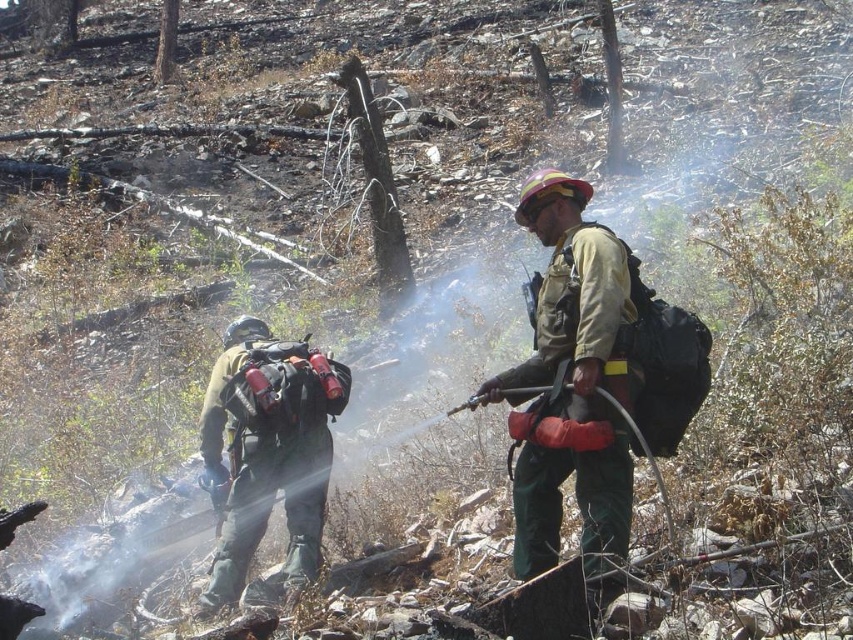
Which of these two, green matte uniform at center or green matte uniform at left, stands taller?

green matte uniform at center

Is green matte uniform at center smaller than green matte uniform at left?

Yes.

Is point (624, 348) positioned behind point (263, 472)?

That is False.

The image size is (853, 640). Identify the location of green matte uniform at center. (573, 381).